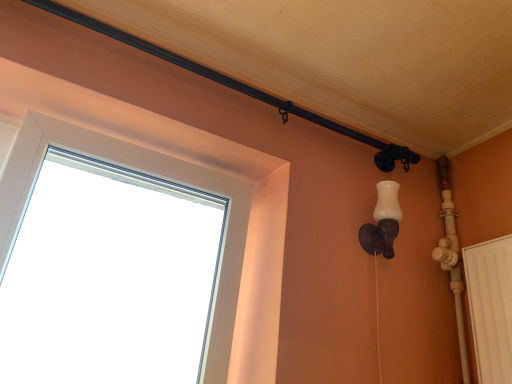
What are the coordinates of `white matte wall sconce at right` in the screenshot? It's located at (383, 221).

Image resolution: width=512 pixels, height=384 pixels. What do you see at coordinates (383, 221) in the screenshot?
I see `white matte wall sconce at right` at bounding box center [383, 221].

What do you see at coordinates (147, 173) in the screenshot?
I see `white plastic window at upper left` at bounding box center [147, 173].

The image size is (512, 384). What are the coordinates of `white plastic window at upper left` in the screenshot? It's located at (147, 173).

Image resolution: width=512 pixels, height=384 pixels. Find the location of `white matte wall sconce at right`. white matte wall sconce at right is located at coordinates (383, 221).

Is white matte wall sconce at right to the left of white plastic window at upper left from the viewer's perspective?

No.

Which object is further away from the camera taking this photo, white matte wall sconce at right or white plastic window at upper left?

Positioned behind is white matte wall sconce at right.

Is point (361, 236) farther from camera compared to point (230, 269)?

Yes, point (361, 236) is farther from viewer.

From the image's perspective, would you say white matte wall sconce at right is shown under white plastic window at upper left?

Correct, white matte wall sconce at right appears lower than white plastic window at upper left in the image.

From a real-world perspective, is white matte wall sconce at right physically below white plastic window at upper left?

Incorrect, from a real-world perspective, white matte wall sconce at right is higher than white plastic window at upper left.

Can you confirm if white matte wall sconce at right is wider than white plastic window at upper left?

No, white matte wall sconce at right is not wider than white plastic window at upper left.

Can you confirm if white matte wall sconce at right is taller than white plastic window at upper left?

Incorrect, the height of white matte wall sconce at right is not larger of that of white plastic window at upper left.

In the scene shown: Based on their sizes in the image, would you say white matte wall sconce at right is bigger or smaller than white plastic window at upper left?

white matte wall sconce at right is smaller than white plastic window at upper left.

From the picture: Can we say white matte wall sconce at right lies outside white plastic window at upper left?

That's correct, white matte wall sconce at right is outside of white plastic window at upper left.

Would you consider white matte wall sconce at right to be distant from white plastic window at upper left?

That's not correct — white matte wall sconce at right is a little close to white plastic window at upper left.

Is white plastic window at upper left at the back of white matte wall sconce at right?

white matte wall sconce at right is not turned away from white plastic window at upper left.

Consider the image. How many degrees apart are the facing directions of white matte wall sconce at right and white plastic window at upper left?

0.514 degrees separate the facing orientations of white matte wall sconce at right and white plastic window at upper left.

Where is `window located in front of the white matte wall sconce at right`? Image resolution: width=512 pixels, height=384 pixels. window located in front of the white matte wall sconce at right is located at coordinates (147, 173).

In the image, is white plastic window at upper left on the left side or the right side of white matte wall sconce at right?

In the image, white plastic window at upper left appears on the left side of white matte wall sconce at right.

Between white plastic window at upper left and white matte wall sconce at right, which one is positioned in front?

Positioned in front is white plastic window at upper left.

Which point is more distant from viewer, (225, 335) or (374, 243)?

Positioned behind is point (374, 243).

From the image's perspective, which one is positioned higher, white plastic window at upper left or white matte wall sconce at right?

white plastic window at upper left appears higher in the image.

From a real-world perspective, is white plastic window at upper left located beneath white matte wall sconce at right?

Yes, from a real-world perspective, white plastic window at upper left is below white matte wall sconce at right.

Is white plastic window at upper left wider or thinner than white matte wall sconce at right?

Clearly, white plastic window at upper left has more width compared to white matte wall sconce at right.

Does white plastic window at upper left have a greater height compared to white matte wall sconce at right?

Yes, white plastic window at upper left is taller than white matte wall sconce at right.

Considering the sizes of white plastic window at upper left and white matte wall sconce at right in the image, is white plastic window at upper left bigger or smaller than white matte wall sconce at right?

Considering their sizes, white plastic window at upper left takes up more space than white matte wall sconce at right.

Which is correct: white plastic window at upper left is inside white matte wall sconce at right, or outside of it?

The correct answer is: outside.

Are white plastic window at upper left and white matte wall sconce at right beside each other?

white plastic window at upper left is not next to white matte wall sconce at right, and they're not touching.

Is white plastic window at upper left turned away from white matte wall sconce at right?

No, white matte wall sconce at right is not at the back of white plastic window at upper left.

Measure the distance between white plastic window at upper left and white matte wall sconce at right.

white plastic window at upper left and white matte wall sconce at right are 23.00 inches apart from each other.

Find the location of a particular element. This screenshot has width=512, height=384. window on the left of white matte wall sconce at right is located at coordinates (147, 173).

Identify the location of light fixture that is below the white plastic window at upper left (from the image's perspective). (383, 221).

This screenshot has height=384, width=512. I want to click on window in front of the white matte wall sconce at right, so [147, 173].